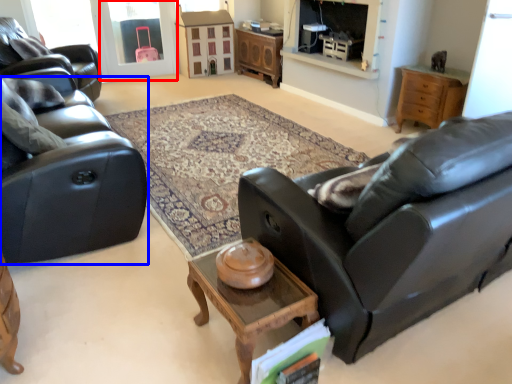
Question: Which object appears farthest to the camera in this image, window screen (highlighted by a red box) or studio couch (highlighted by a blue box)?

Choices:
 (A) window screen
 (B) studio couch

Answer: (A)